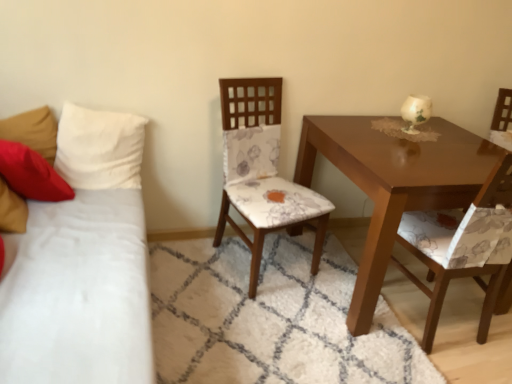
Question: Looking at their shapes, would you say floral fabric chair at center, the first chair viewed from the left, is wider or thinner than glossy wood table at center right?

Choices:
 (A) wide
 (B) thin

Answer: (B)

Question: Considering the positions of point (x=260, y=94) and point (x=316, y=125), is point (x=260, y=94) closer or farther from the camera than point (x=316, y=125)?

Choices:
 (A) farther
 (B) closer

Answer: (A)

Question: Estimate the real-world distances between objects in this image. Which object is farther from the floral fabric chair at right, which ranks as the first chair in right-to-left order?

Choices:
 (A) glossy wood table at center right
 (B) velvety red pillow at left, placed as the first pillow when sorted from left to right
 (C) floral fabric chair at center, the first chair viewed from the left
 (D) white fabric studio couch at left
 (E) white fabric pillow at left, which is the second pillow from left to right

Answer: (B)

Question: Estimate the real-world distances between objects in this image. Which object is farther from the velvety red pillow at left, which is the second pillow in right-to-left order?

Choices:
 (A) floral fabric chair at right, which ranks as the first chair in right-to-left order
 (B) glossy wood table at center right
 (C) floral fabric chair at center, marked as the second chair in a right-to-left arrangement
 (D) white fabric studio couch at left
 (E) white fabric pillow at left, which is the second pillow from left to right

Answer: (A)